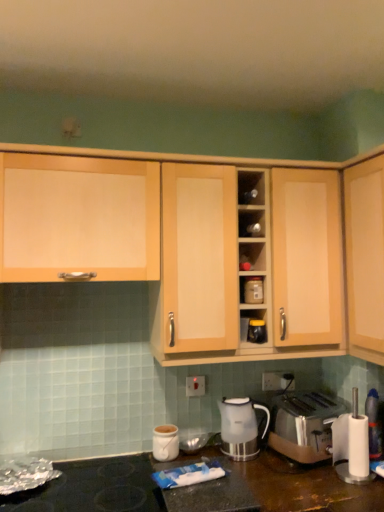
What do you see at coordinates (195, 386) in the screenshot? I see `white plastic electric outlet at center, the second electric outlet positioned from the right` at bounding box center [195, 386].

Looking at this image, in order to face white plastic electric outlet at center, marked as the second electric outlet in a back-to-front arrangement, should I rotate leftwards or rightwards?

Rotate your view right by about 0.438°.

Measure the distance between point (375,263) and camera.

5.38 feet.

Image resolution: width=384 pixels, height=512 pixels. What do you see at coordinates (304, 425) in the screenshot? I see `satin gold toaster at lower right` at bounding box center [304, 425].

In order to click on white plastic blender at lower right in this screenshot , I will do click(x=351, y=445).

What do you see at coordinates (351, 445) in the screenshot? The width and height of the screenshot is (384, 512). I see `white plastic blender at lower right` at bounding box center [351, 445].

Identify the location of white plastic electric outlet at center, the second electric outlet positioned from the right. Image resolution: width=384 pixels, height=512 pixels. (195, 386).

Is white plastic blender at lower right outside of satin gold toaster at lower right?

white plastic blender at lower right lies outside satin gold toaster at lower right's area.

Is white plastic blender at lower right to the right of satin gold toaster at lower right from the viewer's perspective?

Yes.

How different are the orientations of white plastic blender at lower right and satin gold toaster at lower right in degrees?

The angle between the facing direction of white plastic blender at lower right and the facing direction of satin gold toaster at lower right is 1.72 degrees.

Between light wood cabinet at upper left, placed as the third cabinetry when sorted from right to left, and white plastic electric outlet at center, which ranks as the 1th electric outlet in right-to-left order, which one has larger size?

Bigger between the two is light wood cabinet at upper left, placed as the third cabinetry when sorted from right to left.

Is light wood cabinet at upper left, the 1th cabinetry in the left-to-right sequence, taller than white plastic electric outlet at center, the first electric outlet in the back-to-front sequence?

Indeed, light wood cabinet at upper left, the 1th cabinetry in the left-to-right sequence, has a greater height compared to white plastic electric outlet at center, the first electric outlet in the back-to-front sequence.

Measure the distance from light wood cabinet at upper left, placed as the third cabinetry when sorted from right to left, to white plastic electric outlet at center, which ranks as the 1th electric outlet in right-to-left order.

A distance of 3.59 feet exists between light wood cabinet at upper left, placed as the third cabinetry when sorted from right to left, and white plastic electric outlet at center, which ranks as the 1th electric outlet in right-to-left order.

Does light wood cabinet at upper left, placed as the third cabinetry when sorted from right to left, turn towards white plastic electric outlet at center, acting as the second electric outlet starting from the front?

No, light wood cabinet at upper left, placed as the third cabinetry when sorted from right to left, does not turn towards white plastic electric outlet at center, acting as the second electric outlet starting from the front.

The image size is (384, 512). What are the coordinates of `electric outlet that is the 1st object to the left of the white plastic blender at lower right, starting at the anchor` in the screenshot? It's located at (277, 381).

Measure the distance between white plastic blender at lower right and white plastic electric outlet at center, the first electric outlet in the back-to-front sequence.

white plastic blender at lower right is 15.47 inches from white plastic electric outlet at center, the first electric outlet in the back-to-front sequence.

Is white plastic blender at lower right positioned with its back to white plastic electric outlet at center, which ranks as the 1th electric outlet in right-to-left order?

No, white plastic blender at lower right is not facing the opposite direction of white plastic electric outlet at center, which ranks as the 1th electric outlet in right-to-left order.

Which object is closer to the camera, white plastic blender at lower right or white plastic electric outlet at center, acting as the second electric outlet starting from the front?

white plastic blender at lower right.

Measure the distance from light wood cabinet at center, arranged as the 2th cabinetry when viewed from the left, to white glossy kettle at lower center.

light wood cabinet at center, arranged as the 2th cabinetry when viewed from the left, and white glossy kettle at lower center are 21.15 inches apart.

Is point (215, 355) farther from viewer compared to point (246, 421)?

That is False.

Considering the sizes of objects light wood cabinet at center, which ranks as the second cabinetry in right-to-left order, and white glossy kettle at lower center in the image provided, who is bigger, light wood cabinet at center, which ranks as the second cabinetry in right-to-left order, or white glossy kettle at lower center?

light wood cabinet at center, which ranks as the second cabinetry in right-to-left order.

Between light wood cabinet at center, arranged as the 2th cabinetry when viewed from the left, and white glossy kettle at lower center, which one has more height?

With more height is light wood cabinet at center, arranged as the 2th cabinetry when viewed from the left.

From the picture: Between white plastic blender at lower right and white glossy kettle at lower center, which one has larger size?

white plastic blender at lower right is bigger.

Is white plastic blender at lower right turned away from white glossy kettle at lower center?

No, white plastic blender at lower right's orientation is not away from white glossy kettle at lower center.

Considering the positions of objects white plastic blender at lower right and white glossy kettle at lower center in the image provided, who is behind, white plastic blender at lower right or white glossy kettle at lower center?

white glossy kettle at lower center is further from the camera.

In terms of height, does white plastic blender at lower right look taller or shorter compared to white glossy kettle at lower center?

Considering their sizes, white plastic blender at lower right has more height than white glossy kettle at lower center.

Looking at this image, considering the sizes of objects white plastic electric outlet at center, marked as the 1th electric outlet in a front-to-back arrangement, and matte plastic container at center, which is counted as the 1th appliance, starting from the top, in the image provided, who is wider, white plastic electric outlet at center, marked as the 1th electric outlet in a front-to-back arrangement, or matte plastic container at center, which is counted as the 1th appliance, starting from the top,?

Wider between the two is matte plastic container at center, which is counted as the 1th appliance, starting from the top.

In the scene shown: Between white plastic electric outlet at center, acting as the 1th electric outlet starting from the left, and matte plastic container at center, which is counted as the 1th appliance, starting from the top, which one appears on the right side from the viewer's perspective?

matte plastic container at center, which is counted as the 1th appliance, starting from the top, is more to the right.

Locate an element on the screen. the 1st appliance in front of the white plastic electric outlet at center, acting as the 1th electric outlet starting from the left, counting from the anchor's position is located at coordinates (253, 290).

Is point (253, 325) more distant than point (201, 387)?

No.

Does metallic silver toaster at center, the 1th appliance in the bottom-to-top sequence, have a lesser width compared to white plastic electric outlet at center, acting as the 1th electric outlet starting from the left?

Incorrect, the width of metallic silver toaster at center, the 1th appliance in the bottom-to-top sequence, is not less than that of white plastic electric outlet at center, acting as the 1th electric outlet starting from the left.

Which object is closer to the camera, metallic silver toaster at center, the 1th appliance in the bottom-to-top sequence, or white plastic electric outlet at center, marked as the 1th electric outlet in a front-to-back arrangement?

metallic silver toaster at center, the 1th appliance in the bottom-to-top sequence, is in front.

Which object is positioned more to the right, metallic silver toaster at center, which ranks as the second appliance in top-to-bottom order, or white plastic electric outlet at center, marked as the second electric outlet in a back-to-front arrangement?

From the viewer's perspective, metallic silver toaster at center, which ranks as the second appliance in top-to-bottom order, appears more on the right side.

Where is `blender on the right of satin gold toaster at lower right`? blender on the right of satin gold toaster at lower right is located at coordinates (351, 445).

From a real-world perspective, starting from the white plastic electric outlet at center, acting as the 2th electric outlet starting from the left, which cabinetry is the 3rd one vertically above it? Please provide its 2D coordinates.

[(78, 218)]

When comparing their distances from white plastic electric outlet at center, marked as the 1th electric outlet in a front-to-back arrangement, does light wood cabinet at upper right, the third cabinetry viewed from the left, or light wood cabinet at center, which ranks as the second cabinetry in right-to-left order, seem closer?

light wood cabinet at center, which ranks as the second cabinetry in right-to-left order, is closer to white plastic electric outlet at center, marked as the 1th electric outlet in a front-to-back arrangement.

When comparing their distances from light wood cabinet at upper right, the third cabinetry viewed from the left, does white glossy kettle at lower center or light wood cabinet at upper left, the 1th cabinetry in the left-to-right sequence, seem further?

Based on the image, light wood cabinet at upper left, the 1th cabinetry in the left-to-right sequence, appears to be further to light wood cabinet at upper right, the third cabinetry viewed from the left.

Looking at the image, which one is located further to white plastic electric outlet at center, marked as the 1th electric outlet in a front-to-back arrangement, white glossy kettle at lower center or metallic silver toaster at center, the 1th appliance in the bottom-to-top sequence?

metallic silver toaster at center, the 1th appliance in the bottom-to-top sequence, is further to white plastic electric outlet at center, marked as the 1th electric outlet in a front-to-back arrangement.

When comparing their distances from light wood cabinet at center, which ranks as the second cabinetry in right-to-left order, does metallic silver toaster at center, the 1th appliance in the bottom-to-top sequence, or white plastic blender at lower right seem closer?

Based on the image, metallic silver toaster at center, the 1th appliance in the bottom-to-top sequence, appears to be nearer to light wood cabinet at center, which ranks as the second cabinetry in right-to-left order.

Based on their spatial positions, is white plastic blender at lower right or white plastic electric outlet at center, acting as the 1th electric outlet starting from the left, closer to light wood cabinet at center, which ranks as the second cabinetry in right-to-left order?

white plastic blender at lower right.

Based on their spatial positions, is white plastic electric outlet at center, which ranks as the 1th electric outlet in right-to-left order, or light wood cabinet at upper right, the 1th cabinetry from the right, further from black matte gas stove at lower left?

Based on the image, light wood cabinet at upper right, the 1th cabinetry from the right, appears to be further to black matte gas stove at lower left.

From the image, which object appears to be nearer to white ceramic mug at lower center, white plastic blender at lower right or white glossy kettle at lower center?

white glossy kettle at lower center is positioned closer to the anchor white ceramic mug at lower center.

Considering their positions, is white glossy kettle at lower center positioned closer to matte plastic container at center, which is counted as the 1th appliance, starting from the top, than white ceramic mug at lower center?

Result: white glossy kettle at lower center.

I want to click on gas stove between light wood cabinet at upper left, the 1th cabinetry in the left-to-right sequence, and white plastic blender at lower right from left to right, so click(94, 488).

Locate an element on the screen. This screenshot has width=384, height=512. cabinetry between light wood cabinet at upper right, the third cabinetry viewed from the left, and white plastic electric outlet at center, acting as the 2th electric outlet starting from the left, vertically is located at coordinates (270, 271).

In order to click on home appliance between matte plastic container at center, the 2th appliance when ordered from bottom to top, and satin gold toaster at lower right vertically in this screenshot , I will do `click(241, 428)`.

In order to click on home appliance that lies between light wood cabinet at upper left, the 1th cabinetry in the left-to-right sequence, and white ceramic mug at lower center from top to bottom in this screenshot , I will do `click(241, 428)`.